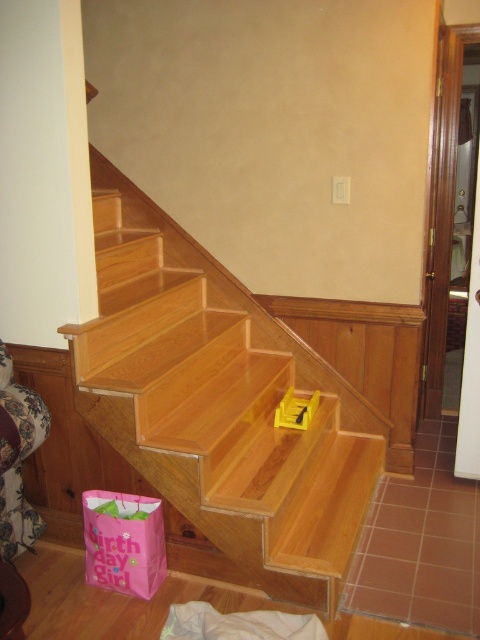
You are standing at the bottom of the staircase and see the point marked at coordinates (219, 403). What object is located at that point?

The point at coordinates (219, 403) corresponds to the natural wood stairs at center.

You are a parent trying to place a yellow plastic toy at center on a step of the natural wood stairs at center. Can the toy fit on the step without falling off?

The natural wood stairs at center is taller than yellow plastic toy at center, so the toy can fit on the step without falling off.